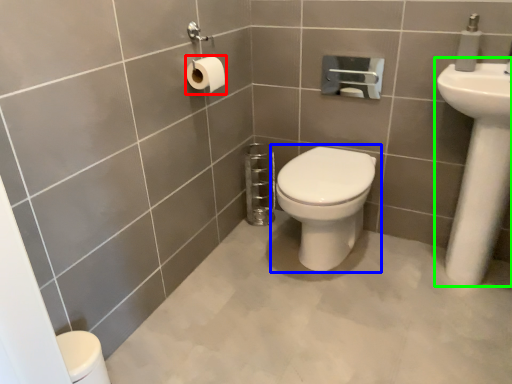
Question: Which is nearer to the toilet paper (highlighted by a red box)? toilet (highlighted by a blue box) or sink (highlighted by a green box).

Choices:
 (A) toilet
 (B) sink

Answer: (A)